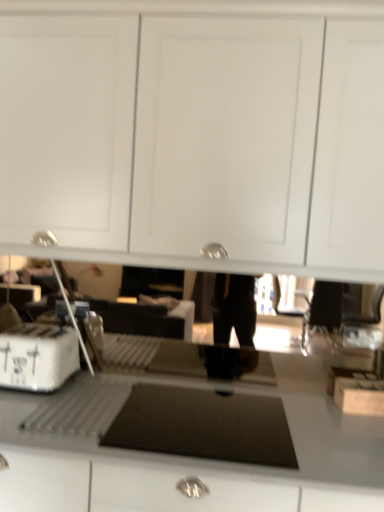
Question: Would you say smooth gray countertop at center is outside white cardboard box at left?

Choices:
 (A) no
 (B) yes

Answer: (B)

Question: From the image's perspective, would you say smooth gray countertop at center is positioned over white cardboard box at left?

Choices:
 (A) no
 (B) yes

Answer: (A)

Question: From a real-world perspective, is smooth gray countertop at center physically below white cardboard box at left?

Choices:
 (A) yes
 (B) no

Answer: (A)

Question: Can you confirm if smooth gray countertop at center is shorter than white cardboard box at left?

Choices:
 (A) no
 (B) yes

Answer: (A)

Question: Is smooth gray countertop at center with white cardboard box at left?

Choices:
 (A) no
 (B) yes

Answer: (A)

Question: Can you confirm if smooth gray countertop at center is bigger than white cardboard box at left?

Choices:
 (A) no
 (B) yes

Answer: (B)

Question: Considering the relative sizes of white cardboard box at left and smooth gray countertop at center in the image provided, is white cardboard box at left smaller than smooth gray countertop at center?

Choices:
 (A) yes
 (B) no

Answer: (A)

Question: Can you see white cardboard box at left touching smooth gray countertop at center?

Choices:
 (A) no
 (B) yes

Answer: (A)

Question: Is white cardboard box at left shorter than smooth gray countertop at center?

Choices:
 (A) no
 (B) yes

Answer: (B)

Question: Is white cardboard box at left taller than smooth gray countertop at center?

Choices:
 (A) no
 (B) yes

Answer: (A)

Question: Is white cardboard box at left not near smooth gray countertop at center?

Choices:
 (A) yes
 (B) no

Answer: (B)

Question: Would you say white cardboard box at left is outside smooth gray countertop at center?

Choices:
 (A) yes
 (B) no

Answer: (A)

Question: Would you say white cardboard box at left is to the left or to the right of smooth gray countertop at center in the picture?

Choices:
 (A) left
 (B) right

Answer: (A)